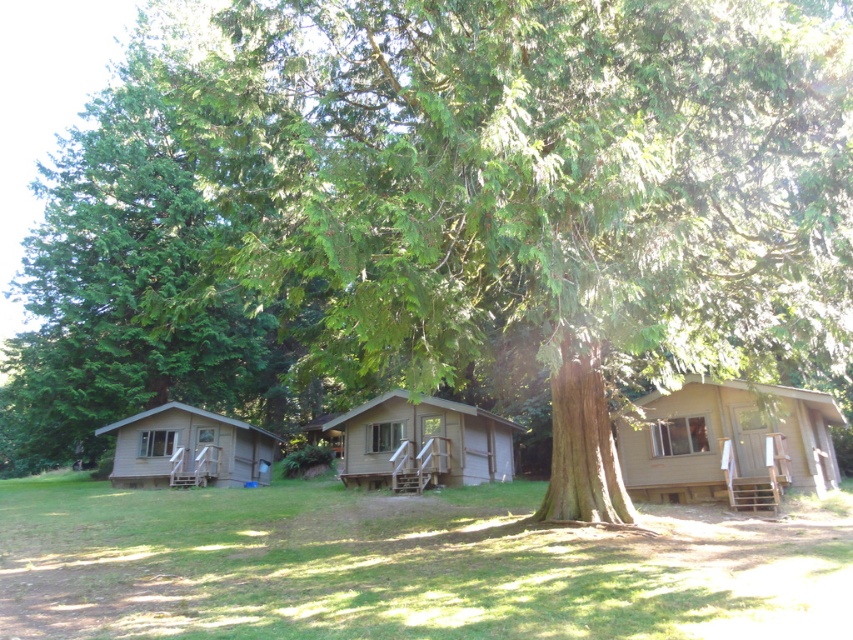
Question: Is green textured tree at left thinner than brown wood cabin at center?

Choices:
 (A) yes
 (B) no

Answer: (B)

Question: Among these points, which one is farthest from the camera?

Choices:
 (A) (265, 524)
 (B) (68, 451)
 (C) (741, 426)
 (D) (221, 458)

Answer: (B)

Question: Which object appears closest to the camera in this image?

Choices:
 (A) green grass at lower center
 (B) green textured tree at left
 (C) brown wood cabin at center

Answer: (A)

Question: Can you confirm if green textured tree at left is positioned to the right of brown wood cabin at left?

Choices:
 (A) yes
 (B) no

Answer: (B)

Question: Does green grass at lower center have a larger size compared to brown wood cabin at right?

Choices:
 (A) no
 (B) yes

Answer: (B)

Question: Which object is positioned farthest from the brown wood cabin at left?

Choices:
 (A) green textured tree at left
 (B) green grass at lower center
 (C) brown wood cabin at right
 (D) brown wood cabin at center

Answer: (C)